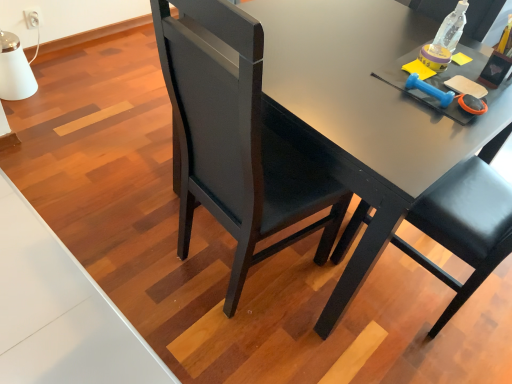
Question: Would you say clear plastic bottle at upper right is to the left or to the right of matte black desk at center in the picture?

Choices:
 (A) right
 (B) left

Answer: (A)

Question: Is clear plastic bottle at upper right spatially inside matte black desk at center, or outside of it?

Choices:
 (A) inside
 (B) outside

Answer: (B)

Question: Considering the real-world distances, which object is closest to the matte black desk at center?

Choices:
 (A) black leather chair at center
 (B) clear plastic bottle at upper right

Answer: (A)

Question: Based on their relative distances, which object is nearer to the black leather chair at center?

Choices:
 (A) matte black desk at center
 (B) clear plastic bottle at upper right

Answer: (A)